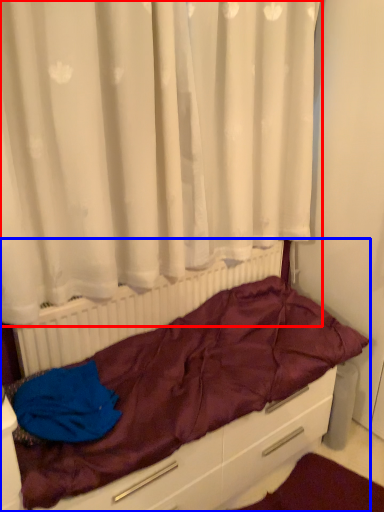
Question: Which object is closer to the camera taking this photo, curtain (highlighted by a red box) or furniture (highlighted by a blue box)?

Choices:
 (A) curtain
 (B) furniture

Answer: (A)